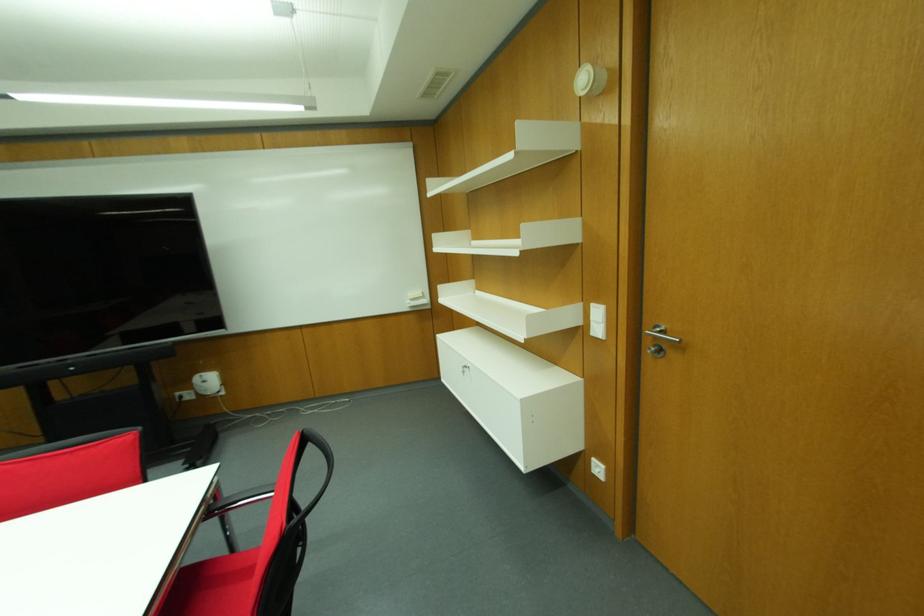
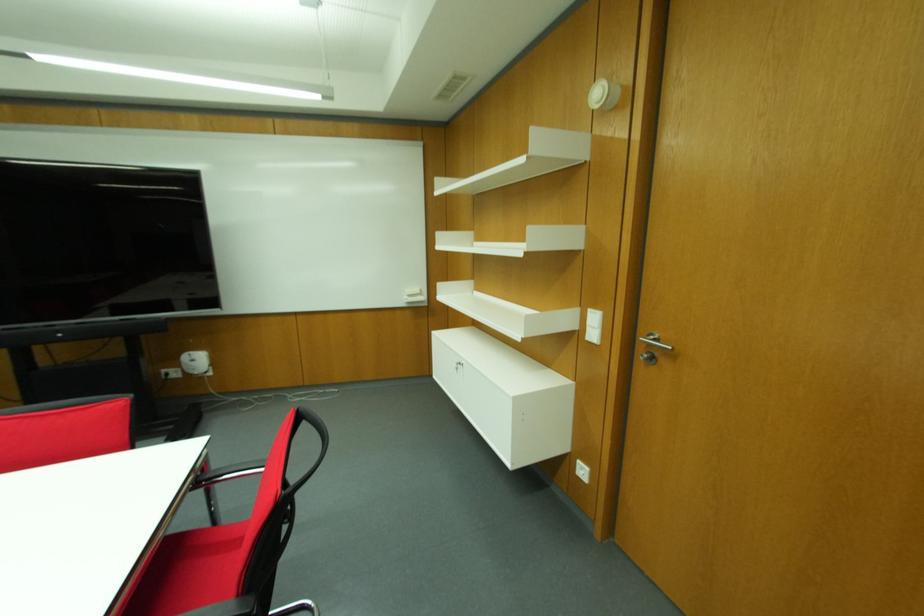
Question: The first image is from the beginning of the video and the second image is from the end. How did the camera likely rotate when shooting the video?

Choices:
 (A) Left
 (B) Right
 (C) Up
 (D) Down

Answer: (B)